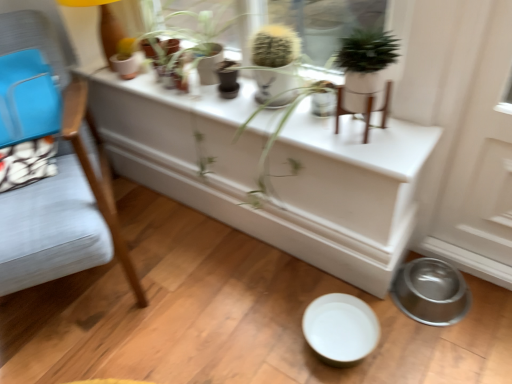
Identify the location of metallic silver bowl at lower right. The width and height of the screenshot is (512, 384). (431, 292).

Describe the element at coordinates (273, 172) in the screenshot. The width and height of the screenshot is (512, 384). I see `white glossy table at center` at that location.

You are a GUI agent. You are given a task and a screenshot of the screen. Output one action in this format:
    pyautogui.click(x=<x>, y=<y>)
    Task: Click on the matte white flowerpot at upper left
    The width and height of the screenshot is (512, 384).
    Given the screenshot: What is the action you would take?
    pyautogui.click(x=127, y=65)

From a real-world perspective, is matte white flowerpot at upper left located beneath green matte plant at upper center, the first houseplant viewed from the front?

Yes.

From the image's perspective, between matte white flowerpot at upper left and green matte plant at upper center, arranged as the second houseplant when viewed from the left, who is located below?

From the image's view, green matte plant at upper center, arranged as the second houseplant when viewed from the left, is below.

Would you say matte white flowerpot at upper left contains green matte plant at upper center, the first houseplant viewed from the front?

Actually, green matte plant at upper center, the first houseplant viewed from the front, is outside matte white flowerpot at upper left.

Locate an element on the screen. The image size is (512, 384). the 2nd houseplant positioned above the matte white flowerpot at upper left (from a real-world perspective) is located at coordinates (365, 69).

Considering the relative positions of matte white flowerpot at upper left and fuzzy green cactus at upper center, the second houseplant from the front, in the image provided, is matte white flowerpot at upper left in front of fuzzy green cactus at upper center, the second houseplant from the front,?

No, matte white flowerpot at upper left is further to the viewer.

Looking at the image, does matte white flowerpot at upper left seem bigger or smaller compared to fuzzy green cactus at upper center, the second houseplant from the front?

matte white flowerpot at upper left is smaller than fuzzy green cactus at upper center, the second houseplant from the front.

Considering the relative positions of matte white flowerpot at upper left and fuzzy green cactus at upper center, which is the second houseplant in right-to-left order, in the image provided, is matte white flowerpot at upper left to the left of fuzzy green cactus at upper center, which is the second houseplant in right-to-left order, from the viewer's perspective?

Correct, you'll find matte white flowerpot at upper left to the left of fuzzy green cactus at upper center, which is the second houseplant in right-to-left order.

Between point (125, 76) and point (292, 30), which one is positioned in front?

The point (292, 30) is closer.

Which is in front, point (464, 287) or point (292, 62)?

The point (292, 62) is closer.

Could you measure the distance between metallic silver bowl at lower right and fuzzy green cactus at upper center, which is the 1th houseplant from back to front?

They are 29.19 inches apart.

Looking at their sizes, would you say metallic silver bowl at lower right is wider or thinner than fuzzy green cactus at upper center, which appears as the 1th houseplant when viewed from the left?

metallic silver bowl at lower right is wider than fuzzy green cactus at upper center, which appears as the 1th houseplant when viewed from the left.

Consider the image. Between metallic silver bowl at lower right and fuzzy green cactus at upper center, the second houseplant from the front, which one is positioned behind?

metallic silver bowl at lower right.

Which point is more forward, (390, 83) or (276, 99)?

Point (390, 83)

Is green matte plant at upper center, which appears as the 2th houseplant when viewed from the back, oriented towards green leafy plant at upper center?

No, green matte plant at upper center, which appears as the 2th houseplant when viewed from the back, is not turned towards green leafy plant at upper center.

Measure the distance from green matte plant at upper center, which appears as the first houseplant when viewed from the right, to green leafy plant at upper center.

green matte plant at upper center, which appears as the first houseplant when viewed from the right, and green leafy plant at upper center are 5.29 feet apart.

From a real-world perspective, who is located higher, green matte plant at upper center, arranged as the second houseplant when viewed from the left, or green leafy plant at upper center?

In real-world perspective, green matte plant at upper center, arranged as the second houseplant when viewed from the left, is above.

Is matte white flowerpot at upper left far from white glossy table at center?

No, matte white flowerpot at upper left is not far from white glossy table at center.

From a real-world perspective, is matte white flowerpot at upper left under white glossy table at center?

No, from a real-world perspective, matte white flowerpot at upper left is not below white glossy table at center.

From the image's perspective, relative to white glossy table at center, is matte white flowerpot at upper left above or below?

matte white flowerpot at upper left is situated higher than white glossy table at center in the image.

Between green matte plant at upper center, arranged as the second houseplant when viewed from the left, and white glossy table at center, which one has larger width?

green matte plant at upper center, arranged as the second houseplant when viewed from the left.

Does green matte plant at upper center, which appears as the 2th houseplant when viewed from the back, turn towards white glossy table at center?

No, green matte plant at upper center, which appears as the 2th houseplant when viewed from the back, is not oriented towards white glossy table at center.

From the image's perspective, who appears lower, green matte plant at upper center, which appears as the 2th houseplant when viewed from the back, or white glossy table at center?

From the image's view, white glossy table at center is below.

Which object is positioned more to the right, fuzzy green cactus at upper center, the second houseplant from the front, or green leafy plant at upper center?

fuzzy green cactus at upper center, the second houseplant from the front.

From a real-world perspective, between fuzzy green cactus at upper center, which is the second houseplant in right-to-left order, and green leafy plant at upper center, who is vertically higher?

From a 3D spatial view, fuzzy green cactus at upper center, which is the second houseplant in right-to-left order, is above.

Does point (252, 56) come behind point (271, 64)?

Yes, point (252, 56) is behind point (271, 64).

Can we say fuzzy green cactus at upper center, which is the 1th houseplant from back to front, lies outside green leafy plant at upper center?

fuzzy green cactus at upper center, which is the 1th houseplant from back to front, is positioned outside green leafy plant at upper center.

Locate an element on the screen. The image size is (512, 384). flowerpot behind the green matte plant at upper center, which appears as the 2th houseplant when viewed from the back is located at coordinates (127, 65).

From the image's perspective, starting from the matte white flowerpot at upper left, which houseplant is the 1st one below? Please provide its 2D coordinates.

[(275, 64)]

Based on their spatial positions, is matte white flowerpot at upper left or fuzzy green cactus at upper center, the second houseplant from the front, further from metallic silver bowl at lower right?

Based on the image, matte white flowerpot at upper left appears to be further to metallic silver bowl at lower right.

Estimate the real-world distances between objects in this image. Which object is closer to light blue fabric chair at left, green leafy plant at upper center or white glossy table at center?

white glossy table at center is closer to light blue fabric chair at left.

Consider the image. Looking at the image, which one is located further to matte white flowerpot at upper left, fuzzy green cactus at upper center, the second houseplant from the front, or white glossy table at center?

Based on the image, white glossy table at center appears to be further to matte white flowerpot at upper left.

Which object lies nearer to the anchor point light blue fabric chair at left, green leafy plant at upper center or metallic silver bowl at lower right?

Based on the image, metallic silver bowl at lower right appears to be nearer to light blue fabric chair at left.

Considering their positions, is green matte plant at upper center, which appears as the first houseplant when viewed from the right, positioned closer to fuzzy green cactus at upper center, the second houseplant from the front, than light blue fabric chair at left?

The object closer to fuzzy green cactus at upper center, the second houseplant from the front, is green matte plant at upper center, which appears as the first houseplant when viewed from the right.

In the scene shown: Considering their positions, is light blue fabric chair at left positioned further to green matte plant at upper center, which appears as the first houseplant when viewed from the right, than metallic silver bowl at lower right?

Among the two, light blue fabric chair at left is located further to green matte plant at upper center, which appears as the first houseplant when viewed from the right.

Estimate the real-world distances between objects in this image. Which object is closer to fuzzy green cactus at upper center, which appears as the 1th houseplant when viewed from the left, metallic silver bowl at lower right or light blue fabric chair at left?

light blue fabric chair at left is closer to fuzzy green cactus at upper center, which appears as the 1th houseplant when viewed from the left.

When comparing their distances from matte white flowerpot at upper left, does green matte plant at upper center, the first houseplant viewed from the front, or metallic silver bowl at lower right seem further?

Based on the image, metallic silver bowl at lower right appears to be further to matte white flowerpot at upper left.

Identify the location of table between matte white flowerpot at upper left and fuzzy green cactus at upper center, which is the second houseplant in right-to-left order, in the horizontal direction. (273, 172).

Identify the location of floral arrangement between matte white flowerpot at upper left and fuzzy green cactus at upper center, which is the 1th houseplant from back to front, in the horizontal direction. (325, 66).

Locate an element on the screen. floral arrangement located between light blue fabric chair at left and fuzzy green cactus at upper center, which is the second houseplant in right-to-left order, in the left-right direction is located at coordinates (325, 66).

This screenshot has width=512, height=384. In order to click on table between light blue fabric chair at left and metallic silver bowl at lower right from left to right in this screenshot , I will do `click(273, 172)`.